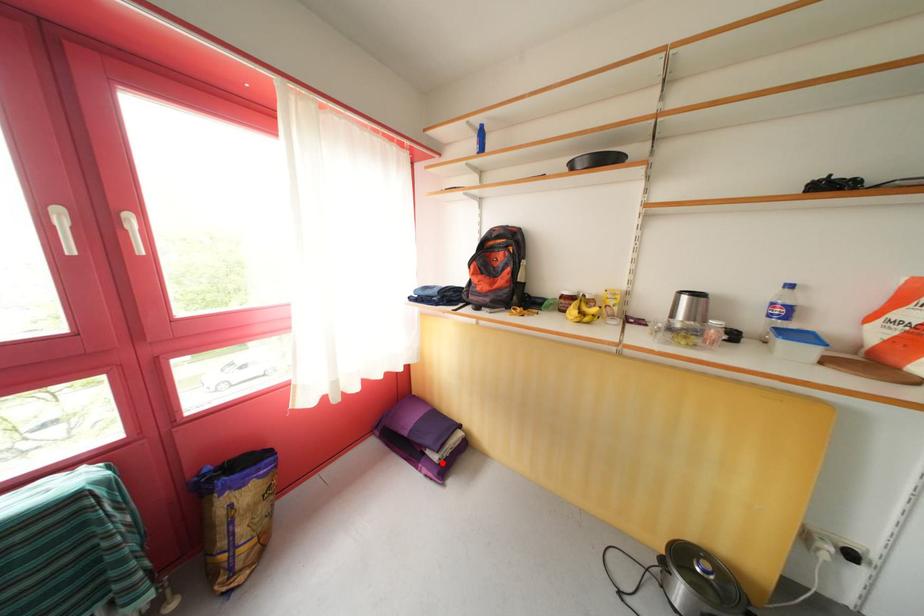
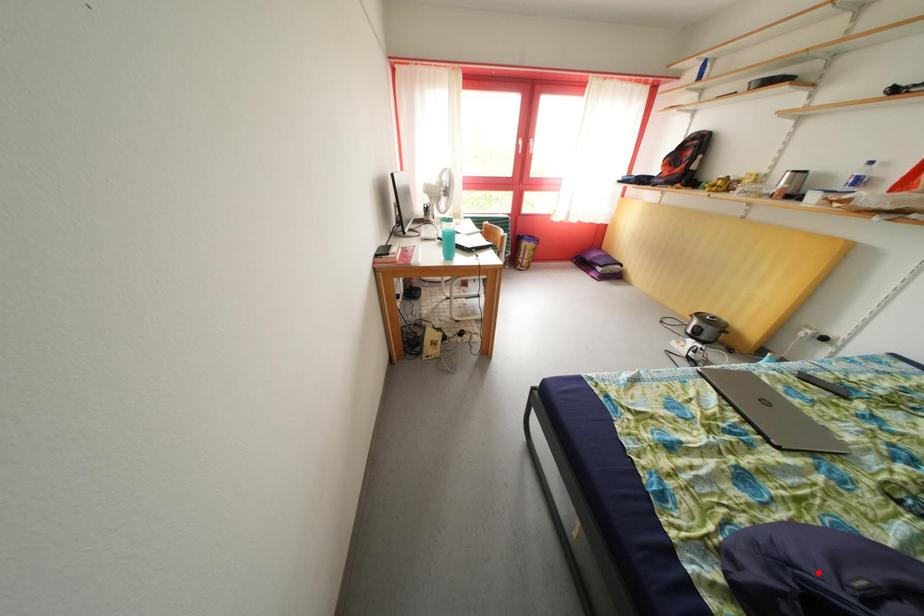
I am providing you with two images of the same scene from different viewpoints. A red point is marked on the first image and another point is marked on the second image. Does the point marked in image1 correspond to the same location as the one in image2?

No